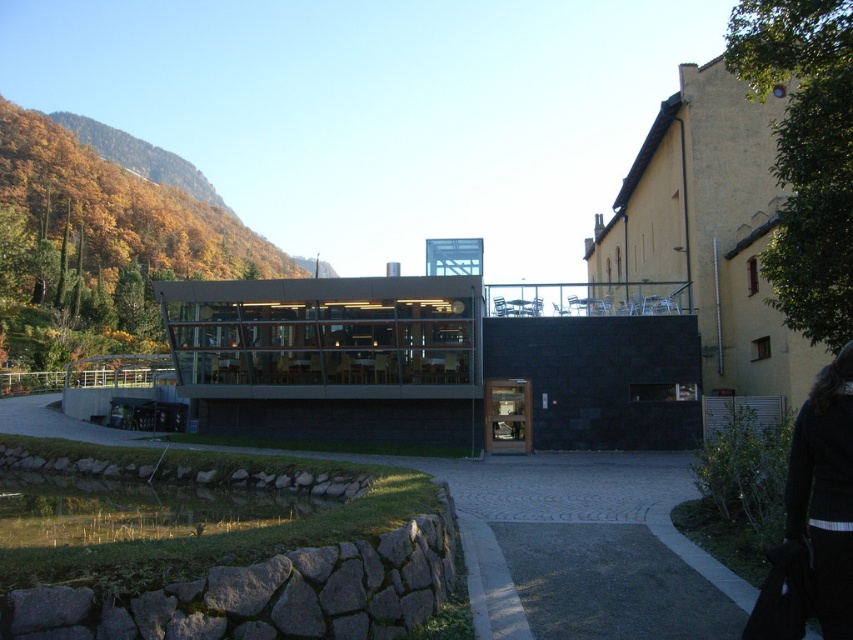
Question: Which of the following is the closest to the observer?

Choices:
 (A) black fabric at lower right
 (B) paved stone path at center

Answer: (A)

Question: Is paved stone path at center closer to the viewer compared to black fabric at lower right?

Choices:
 (A) yes
 (B) no

Answer: (B)

Question: Where is paved stone path at center located in relation to black fabric at lower right in the image?

Choices:
 (A) below
 (B) above

Answer: (A)

Question: Which object appears farthest from the camera in this image?

Choices:
 (A) paved stone path at center
 (B) black fabric at lower right

Answer: (A)

Question: Is paved stone path at center bigger than black fabric at lower right?

Choices:
 (A) no
 (B) yes

Answer: (B)